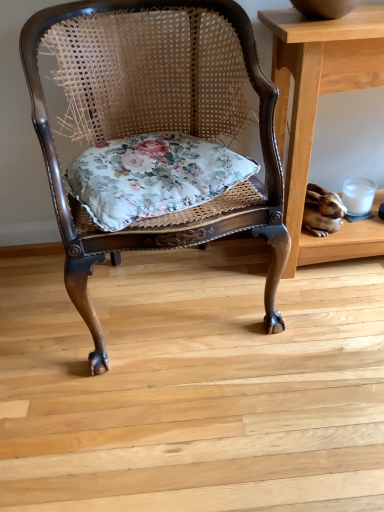
Question: Does light brown wooden table at right have a greater height compared to rattan chair with floral cushion at center?

Choices:
 (A) no
 (B) yes

Answer: (A)

Question: From the image's perspective, is light brown wooden table at right located above rattan chair with floral cushion at center?

Choices:
 (A) no
 (B) yes

Answer: (B)

Question: Can you confirm if light brown wooden table at right is positioned to the left of rattan chair with floral cushion at center?

Choices:
 (A) yes
 (B) no

Answer: (B)

Question: Is light brown wooden table at right positioned beyond the bounds of rattan chair with floral cushion at center?

Choices:
 (A) no
 (B) yes

Answer: (B)

Question: Considering the relative sizes of light brown wooden table at right and rattan chair with floral cushion at center in the image provided, is light brown wooden table at right smaller than rattan chair with floral cushion at center?

Choices:
 (A) no
 (B) yes

Answer: (B)

Question: Does point (195, 33) appear closer or farther from the camera than point (231, 166)?

Choices:
 (A) closer
 (B) farther

Answer: (B)

Question: From the image's perspective, is rattan chair with floral cushion at center positioned above or below floral fabric cushion at center?

Choices:
 (A) above
 (B) below

Answer: (B)

Question: From a real-world perspective, is rattan chair with floral cushion at center above or below floral fabric cushion at center?

Choices:
 (A) above
 (B) below

Answer: (B)

Question: From their relative heights in the image, would you say rattan chair with floral cushion at center is taller or shorter than floral fabric cushion at center?

Choices:
 (A) short
 (B) tall

Answer: (B)

Question: Considering the positions of floral fabric cushion at center and rattan chair with floral cushion at center in the image, is floral fabric cushion at center taller or shorter than rattan chair with floral cushion at center?

Choices:
 (A) short
 (B) tall

Answer: (A)

Question: Based on their sizes in the image, would you say floral fabric cushion at center is bigger or smaller than rattan chair with floral cushion at center?

Choices:
 (A) small
 (B) big

Answer: (A)

Question: Considering the relative positions of floral fabric cushion at center and rattan chair with floral cushion at center in the image provided, is floral fabric cushion at center to the left or to the right of rattan chair with floral cushion at center?

Choices:
 (A) left
 (B) right

Answer: (B)

Question: Choose the correct answer: Is floral fabric cushion at center inside rattan chair with floral cushion at center or outside it?

Choices:
 (A) inside
 (B) outside

Answer: (A)

Question: Considering the positions of point (326, 36) and point (157, 190), is point (326, 36) closer or farther from the camera than point (157, 190)?

Choices:
 (A) farther
 (B) closer

Answer: (B)

Question: Looking at their shapes, would you say light brown wooden table at right is wider or thinner than floral fabric cushion at center?

Choices:
 (A) wide
 (B) thin

Answer: (B)